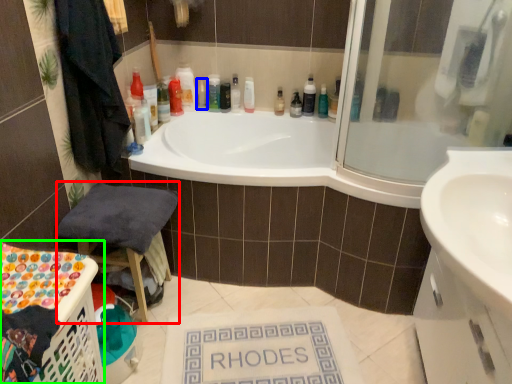
Question: Considering the real-world distances, which object is farthest from chair (highlighted by a red box)? toiletry (highlighted by a blue box) or laundry basket (highlighted by a green box)?

Choices:
 (A) toiletry
 (B) laundry basket

Answer: (A)